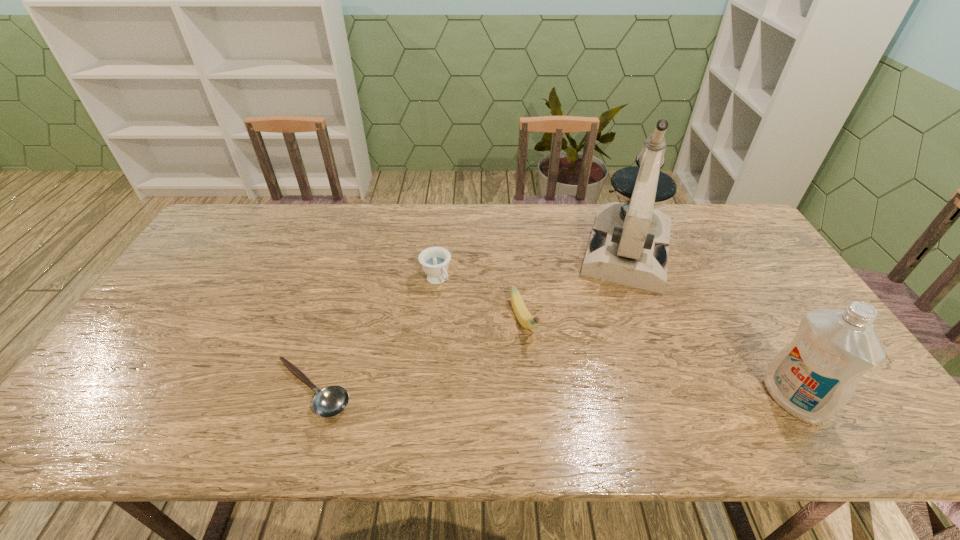
The image size is (960, 540). In order to click on free space located 0.080m on the back of the detergent in this screenshot , I will do `click(761, 346)`.

Image resolution: width=960 pixels, height=540 pixels. Identify the location of free space located 0.070m on the side of the fourth object from right to left with the handle. (455, 306).

This screenshot has height=540, width=960. What are the coordinates of `vacant space located on the side of the fourth object from right to left with the handle` in the screenshot? It's located at (477, 334).

I want to click on free region located on the side of the fourth object from right to left with the handle, so click(x=523, y=392).

Find the location of `vacant region located at the stem of the third object from right to left`. vacant region located at the stem of the third object from right to left is located at coordinates (538, 364).

This screenshot has height=540, width=960. Find the location of `free spot located 0.060m at the stem of the third object from right to left`. free spot located 0.060m at the stem of the third object from right to left is located at coordinates (538, 364).

This screenshot has width=960, height=540. Find the location of `vacant position located 0.170m at the eyepiece of the tallest object`. vacant position located 0.170m at the eyepiece of the tallest object is located at coordinates (615, 333).

Find the location of a particular element. The height and width of the screenshot is (540, 960). vacant region located at the eyepiece of the tallest object is located at coordinates click(x=612, y=355).

The height and width of the screenshot is (540, 960). Find the location of `vacant region located at the eyepiece of the tallest object`. vacant region located at the eyepiece of the tallest object is located at coordinates (615, 330).

The height and width of the screenshot is (540, 960). Find the location of `object present at the far edge`. object present at the far edge is located at coordinates (629, 245).